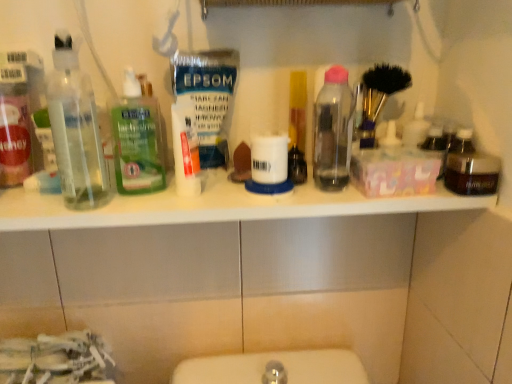
In order to face white plastic shelf at upper center, should I rotate leftwards or rightwards?

You should rotate left by 3.137 degrees.

The width and height of the screenshot is (512, 384). I want to click on transparent plastic bottle at center, which is the second bottle from right to left, so click(x=333, y=130).

In order to face green translucent liquid at center, arranged as the second bottle when viewed from the left, should I rotate leftwards or rightwards?

You should rotate left by 14.319 degrees.

Describe the element at coordinates (470, 167) in the screenshot. The height and width of the screenshot is (384, 512). I see `dark brown glass jar at right, the first bottle viewed from the right` at that location.

You are a GUI agent. You are given a task and a screenshot of the screen. Output one action in this format:
    pyautogui.click(x=<x>, y=<y>)
    Task: Click on the white matte tube at center
    The height and width of the screenshot is (384, 512).
    Given the screenshot: What is the action you would take?
    pyautogui.click(x=185, y=150)

In the scene shown: From the image's perspective, is dark brown glass jar at right, the first bottle viewed from the right, on top of transparent plastic bottle at center, arranged as the third bottle when viewed from the left?

No.

Image resolution: width=512 pixels, height=384 pixels. I want to click on bottle located underneath the transparent plastic bottle at center, arranged as the third bottle when viewed from the left (from a real-world perspective), so click(470, 167).

Which is closer to the camera, (x=476, y=170) or (x=328, y=77)?

Point (x=476, y=170)

Could you tell me if translucent plastic bottle at center is turned towards white matte tube at center?

No, translucent plastic bottle at center is not oriented towards white matte tube at center.

From the picture: Considering the sizes of objects translucent plastic bottle at center and white matte tube at center in the image provided, who is taller, translucent plastic bottle at center or white matte tube at center?

translucent plastic bottle at center is taller.

Considering the relative sizes of translucent plastic bottle at center and white matte tube at center in the image provided, is translucent plastic bottle at center thinner than white matte tube at center?

Incorrect, the width of translucent plastic bottle at center is not less than that of white matte tube at center.

From the image's perspective, relative to transparent plastic bottles at left, which appears as the first bottle when viewed from the left, is translucent plastic bottle at center above or below?

translucent plastic bottle at center is situated higher than transparent plastic bottles at left, which appears as the first bottle when viewed from the left, in the image.

From a real-world perspective, between translucent plastic bottle at center and transparent plastic bottles at left, positioned as the fourth bottle in right-to-left order, who is vertically lower?

From a 3D spatial view, translucent plastic bottle at center is below.

Can you confirm if translucent plastic bottle at center is wider than transparent plastic bottles at left, which appears as the first bottle when viewed from the left?

Yes.

How different are the orientations of translucent plastic bottle at center and transparent plastic bottles at left, which appears as the first bottle when viewed from the left, in degrees?

4.59 degrees.

In the image, is transparent plastic bottle at center, arranged as the third bottle when viewed from the left, positioned in front of or behind transparent plastic bottles at left, which appears as the first bottle when viewed from the left?

transparent plastic bottle at center, arranged as the third bottle when viewed from the left, is positioned farther from the viewer than transparent plastic bottles at left, which appears as the first bottle when viewed from the left.

From a real-world perspective, is transparent plastic bottle at center, arranged as the third bottle when viewed from the left, above or below transparent plastic bottles at left, which appears as the first bottle when viewed from the left?

Clearly, from a real-world perspective, transparent plastic bottle at center, arranged as the third bottle when viewed from the left, is below transparent plastic bottles at left, which appears as the first bottle when viewed from the left.

Could you tell me if transparent plastic bottle at center, which is the second bottle from right to left, is facing transparent plastic bottles at left, which appears as the first bottle when viewed from the left?

No, transparent plastic bottle at center, which is the second bottle from right to left, is not aimed at transparent plastic bottles at left, which appears as the first bottle when viewed from the left.

Based on their sizes in the image, would you say transparent plastic bottle at center, arranged as the third bottle when viewed from the left, is bigger or smaller than transparent plastic bottles at left, positioned as the fourth bottle in right-to-left order?

Clearly, transparent plastic bottle at center, arranged as the third bottle when viewed from the left, is larger in size than transparent plastic bottles at left, positioned as the fourth bottle in right-to-left order.

Considering the relative sizes of white plastic shelf at upper center and translucent plastic bottle at center in the image provided, is white plastic shelf at upper center shorter than translucent plastic bottle at center?

Yes, white plastic shelf at upper center is shorter than translucent plastic bottle at center.

Is white plastic shelf at upper center wider than translucent plastic bottle at center?

Yes, white plastic shelf at upper center is wider than translucent plastic bottle at center.

Consider the image. From a real-world perspective, is white plastic shelf at upper center under translucent plastic bottle at center?

Correct, in the physical world, white plastic shelf at upper center is lower than translucent plastic bottle at center.

Which object is positioned more to the right, white plastic shelf at upper center or translucent plastic bottle at center?

Positioned to the right is translucent plastic bottle at center.

In the scene shown: Is dark brown glass jar at right, which is counted as the 4th bottle, starting from the left, beside white plastic shelf at upper center?

No, dark brown glass jar at right, which is counted as the 4th bottle, starting from the left, is not beside white plastic shelf at upper center.

Is dark brown glass jar at right, the first bottle viewed from the right, turned away from white plastic shelf at upper center?

dark brown glass jar at right, the first bottle viewed from the right, is not turned away from white plastic shelf at upper center.

Which of these two, dark brown glass jar at right, which is counted as the 4th bottle, starting from the left, or white plastic shelf at upper center, stands taller?

With more height is dark brown glass jar at right, which is counted as the 4th bottle, starting from the left.

In terms of width, does dark brown glass jar at right, the first bottle viewed from the right, look wider or thinner when compared to white plastic shelf at upper center?

Clearly, dark brown glass jar at right, the first bottle viewed from the right, has less width compared to white plastic shelf at upper center.

Which object is thinner, green translucent liquid at center, arranged as the second bottle when viewed from the left, or white plastic shelf at upper center?

With smaller width is green translucent liquid at center, arranged as the second bottle when viewed from the left.

From the image's perspective, would you say green translucent liquid at center, arranged as the second bottle when viewed from the left, is positioned over white plastic shelf at upper center?

Yes, from the image's perspective, green translucent liquid at center, arranged as the second bottle when viewed from the left, is over white plastic shelf at upper center.

Between green translucent liquid at center, arranged as the second bottle when viewed from the left, and white plastic shelf at upper center, which one appears on the left side from the viewer's perspective?

green translucent liquid at center, arranged as the second bottle when viewed from the left, is more to the left.

From a real-world perspective, who is located higher, green translucent liquid at center, which appears as the 3th bottle when viewed from the right, or white plastic shelf at upper center?

green translucent liquid at center, which appears as the 3th bottle when viewed from the right.

Image resolution: width=512 pixels, height=384 pixels. What are the coordinates of `the 2nd bottle above when counting from the dark brown glass jar at right, which is counted as the 4th bottle, starting from the left (from the image's perspective)` in the screenshot? It's located at (333, 130).

Where is `toiletry below the translucent plastic bottle at center (from a real-world perspective)`? This screenshot has height=384, width=512. toiletry below the translucent plastic bottle at center (from a real-world perspective) is located at coordinates pyautogui.click(x=185, y=150).

From the image, which object appears to be nearer to white matte tube at center, transparent plastic bottle at center, which is the second bottle from right to left, or translucent plastic bottle at center?

translucent plastic bottle at center.

Estimate the real-world distances between objects in this image. Which object is further from white matte tube at center, white plastic shelf at upper center or transparent plastic bottles at left, positioned as the fourth bottle in right-to-left order?

The object further to white matte tube at center is transparent plastic bottles at left, positioned as the fourth bottle in right-to-left order.

From the image, which object appears to be farther from transparent plastic bottles at left, which appears as the first bottle when viewed from the left, white matte tube at center or dark brown glass jar at right, the first bottle viewed from the right?

dark brown glass jar at right, the first bottle viewed from the right, is further to transparent plastic bottles at left, which appears as the first bottle when viewed from the left.

Estimate the real-world distances between objects in this image. Which object is further from transparent plastic bottles at left, which appears as the first bottle when viewed from the left, transparent plastic bottle at center, arranged as the third bottle when viewed from the left, or translucent plastic bottle at center?

The object further to transparent plastic bottles at left, which appears as the first bottle when viewed from the left, is transparent plastic bottle at center, arranged as the third bottle when viewed from the left.

Looking at this image, from the image, which object appears to be farther from translucent plastic bottle at center, transparent plastic bottles at left, which appears as the first bottle when viewed from the left, or white matte tube at center?

transparent plastic bottles at left, which appears as the first bottle when viewed from the left, is positioned further to the anchor translucent plastic bottle at center.

Which object lies further to the anchor point white matte tube at center, transparent plastic bottles at left, positioned as the fourth bottle in right-to-left order, or transparent plastic bottle at center, arranged as the third bottle when viewed from the left?

transparent plastic bottle at center, arranged as the third bottle when viewed from the left, is positioned further to the anchor white matte tube at center.

Estimate the real-world distances between objects in this image. Which object is closer to transparent plastic bottle at center, arranged as the third bottle when viewed from the left, green translucent liquid at center, arranged as the second bottle when viewed from the left, or white matte tube at center?

white matte tube at center is closer to transparent plastic bottle at center, arranged as the third bottle when viewed from the left.

Which object lies nearer to the anchor point dark brown glass jar at right, which is counted as the 4th bottle, starting from the left, transparent plastic bottles at left, positioned as the fourth bottle in right-to-left order, or white matte tube at center?

white matte tube at center lies closer to dark brown glass jar at right, which is counted as the 4th bottle, starting from the left, than the other object.

This screenshot has width=512, height=384. I want to click on toiletry between green translucent liquid at center, which appears as the 3th bottle when viewed from the right, and translucent plastic bottle at center, so click(x=185, y=150).

At what (x,y) coordinates should I click in order to perform the action: click on toiletry between green translucent liquid at center, arranged as the second bottle when viewed from the left, and dark brown glass jar at right, the first bottle viewed from the right, from left to right. Please return your answer as a coordinate pair (x, y). This screenshot has height=384, width=512. Looking at the image, I should click on (185, 150).

Locate an element on the screen. This screenshot has height=384, width=512. bottle between transparent plastic bottles at left, which appears as the first bottle when viewed from the left, and white matte tube at center is located at coordinates (137, 140).

Identify the location of counter top between transparent plastic bottles at left, positioned as the fourth bottle in right-to-left order, and dark brown glass jar at right, the first bottle viewed from the right, in the horizontal direction. The height and width of the screenshot is (384, 512). (218, 206).